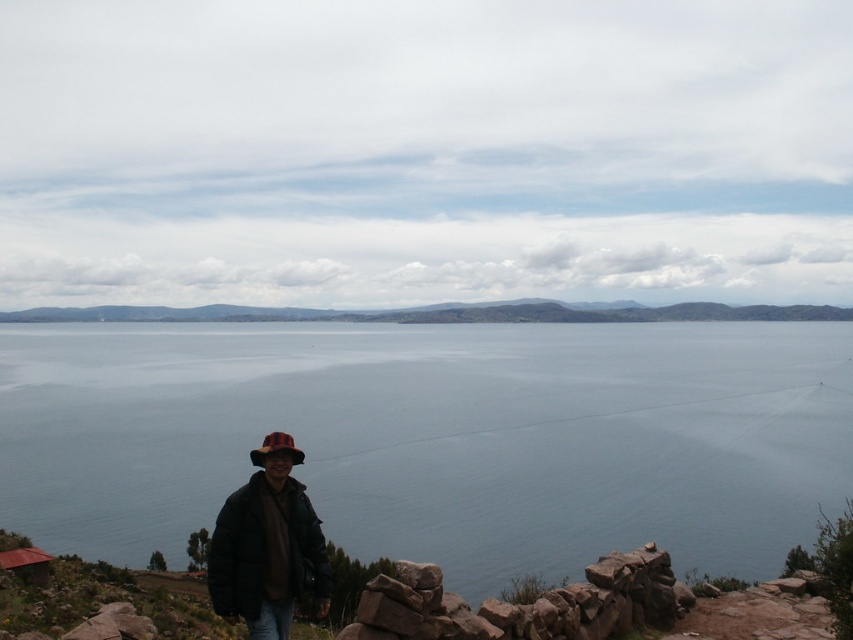
Does dark brown matte jacket at lower left have a smaller size compared to red felt hat at lower center?

Correct, dark brown matte jacket at lower left occupies less space than red felt hat at lower center.

Is dark brown matte jacket at lower left to the left of red felt hat at lower center from the viewer's perspective?

In fact, dark brown matte jacket at lower left is to the right of red felt hat at lower center.

Does point (218, 577) lie behind point (292, 445)?

No, it is not.

You are a GUI agent. You are given a task and a screenshot of the screen. Output one action in this format:
    pyautogui.click(x=<x>, y=<y>)
    Task: Click on the dark brown matte jacket at lower left
    The width and height of the screenshot is (853, 640).
    Given the screenshot: What is the action you would take?
    pyautogui.click(x=238, y=554)

In the scene shown: Does blue water at center have a greater height compared to green grassy hillside at center?

No, blue water at center is not taller than green grassy hillside at center.

Measure the distance between blue water at center and camera.

They are 23.42 feet apart.

Which is in front, point (317, 472) or point (79, 316)?

Point (317, 472) is in front.

Find the location of `blue water at center`. blue water at center is located at coordinates (436, 436).

Between point (376, 358) and point (302, 456), which one is positioned behind?

The point (376, 358) is behind.

Does blue water at center appear under red felt hat at lower center?

Actually, blue water at center is above red felt hat at lower center.

The image size is (853, 640). What do you see at coordinates (436, 436) in the screenshot?
I see `blue water at center` at bounding box center [436, 436].

Where is `blue water at center`? This screenshot has width=853, height=640. blue water at center is located at coordinates (436, 436).